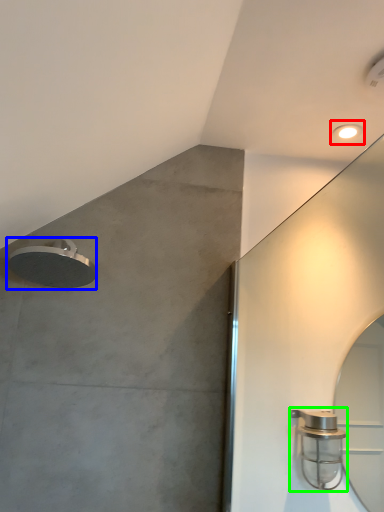
Question: Estimate the real-world distances between objects in this image. Which object is closer to droplight (highlighted by a red box), shower (highlighted by a blue box) or shower (highlighted by a green box)?

Choices:
 (A) shower
 (B) shower

Answer: (B)